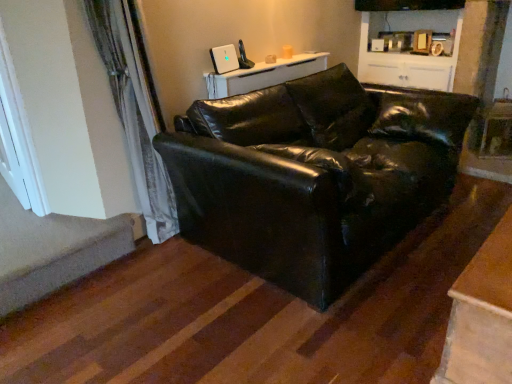
Question: Does white painted wood window at left turn towards white glossy cabinet at upper center?

Choices:
 (A) yes
 (B) no

Answer: (B)

Question: Is white painted wood window at left facing away from white glossy cabinet at upper center?

Choices:
 (A) no
 (B) yes

Answer: (B)

Question: Is white painted wood window at left positioned far away from white glossy cabinet at upper center?

Choices:
 (A) no
 (B) yes

Answer: (B)

Question: From a real-world perspective, is white painted wood window at left below white glossy cabinet at upper center?

Choices:
 (A) yes
 (B) no

Answer: (A)

Question: Considering the relative sizes of white painted wood window at left and white glossy cabinet at upper center in the image provided, is white painted wood window at left smaller than white glossy cabinet at upper center?

Choices:
 (A) yes
 (B) no

Answer: (A)

Question: Can you confirm if white painted wood window at left is taller than white glossy cabinet at upper center?

Choices:
 (A) yes
 (B) no

Answer: (B)

Question: Can you see carpeted stairwell at lower left touching wooden table at lower right, positioned as the 2th table in top-to-bottom order?

Choices:
 (A) no
 (B) yes

Answer: (A)

Question: Is wooden table at lower right, which ranks as the 1th table in right-to-left order, inside carpeted stairwell at lower left?

Choices:
 (A) yes
 (B) no

Answer: (B)

Question: From a real-world perspective, is carpeted stairwell at lower left located beneath wooden table at lower right, marked as the second table in a left-to-right arrangement?

Choices:
 (A) yes
 (B) no

Answer: (A)

Question: Is carpeted stairwell at lower left positioned behind wooden table at lower right, positioned as the 2th table in top-to-bottom order?

Choices:
 (A) no
 (B) yes

Answer: (B)

Question: Considering the relative sizes of carpeted stairwell at lower left and wooden table at lower right, which is counted as the 2th table, starting from the back, in the image provided, is carpeted stairwell at lower left shorter than wooden table at lower right, which is counted as the 2th table, starting from the back,?

Choices:
 (A) yes
 (B) no

Answer: (A)

Question: Is carpeted stairwell at lower left positioned before wooden table at lower right, marked as the second table in a left-to-right arrangement?

Choices:
 (A) no
 (B) yes

Answer: (A)

Question: Considering the relative sizes of white glossy cabinet at upper center and wooden table at lower right, which is the first table in front-to-back order, in the image provided, is white glossy cabinet at upper center thinner than wooden table at lower right, which is the first table in front-to-back order,?

Choices:
 (A) no
 (B) yes

Answer: (A)